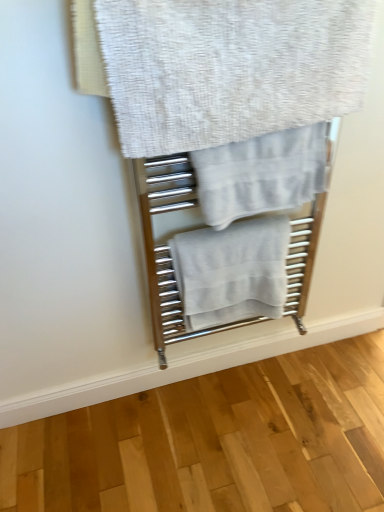
Question: Can we say white cotton towel at center, the 3th towel in the top-to-bottom sequence, lies outside light gray cotton towel at center, which ranks as the second towel in top-to-bottom order?

Choices:
 (A) yes
 (B) no

Answer: (A)

Question: Considering the relative sizes of white cotton towel at center, the 3th towel in the top-to-bottom sequence, and light gray cotton towel at center, which is the second towel from bottom to top, in the image provided, is white cotton towel at center, the 3th towel in the top-to-bottom sequence, smaller than light gray cotton towel at center, which is the second towel from bottom to top,?

Choices:
 (A) no
 (B) yes

Answer: (A)

Question: From the image's perspective, is white cotton towel at center, which is the 1th towel in bottom-to-top order, on light gray cotton towel at center, which is the second towel from bottom to top?

Choices:
 (A) yes
 (B) no

Answer: (B)

Question: Does white cotton towel at center, the 3th towel in the top-to-bottom sequence, lie behind light gray cotton towel at center, which ranks as the second towel in top-to-bottom order?

Choices:
 (A) yes
 (B) no

Answer: (A)

Question: Can you confirm if white cotton towel at center, which is the 1th towel in bottom-to-top order, is bigger than light gray cotton towel at center, which is the second towel from bottom to top?

Choices:
 (A) yes
 (B) no

Answer: (A)

Question: Is white cotton towel at center, which is the 1th towel in bottom-to-top order, facing away from light gray cotton towel at center, which ranks as the second towel in top-to-bottom order?

Choices:
 (A) no
 (B) yes

Answer: (A)

Question: Can you confirm if white cotton towel at center, which is the 1th towel in bottom-to-top order, is taller than white textured towel at upper center, marked as the third towel in a bottom-to-top arrangement?

Choices:
 (A) no
 (B) yes

Answer: (B)

Question: Can we say white cotton towel at center, which is the 1th towel in bottom-to-top order, lies outside white textured towel at upper center, marked as the third towel in a bottom-to-top arrangement?

Choices:
 (A) yes
 (B) no

Answer: (A)

Question: Is white cotton towel at center, the 3th towel in the top-to-bottom sequence, closer to the viewer compared to white textured towel at upper center, marked as the third towel in a bottom-to-top arrangement?

Choices:
 (A) no
 (B) yes

Answer: (A)

Question: Is white cotton towel at center, the 3th towel in the top-to-bottom sequence, bigger than white textured towel at upper center, marked as the third towel in a bottom-to-top arrangement?

Choices:
 (A) no
 (B) yes

Answer: (A)

Question: Can you confirm if white cotton towel at center, which is the 1th towel in bottom-to-top order, is wider than white textured towel at upper center, acting as the first towel starting from the top?

Choices:
 (A) yes
 (B) no

Answer: (A)

Question: Does white cotton towel at center, which is the 1th towel in bottom-to-top order, touch white textured towel at upper center, acting as the first towel starting from the top?

Choices:
 (A) no
 (B) yes

Answer: (A)

Question: Can you confirm if white textured towel at upper center, marked as the third towel in a bottom-to-top arrangement, is thinner than white cotton towel at center, the 3th towel in the top-to-bottom sequence?

Choices:
 (A) yes
 (B) no

Answer: (A)